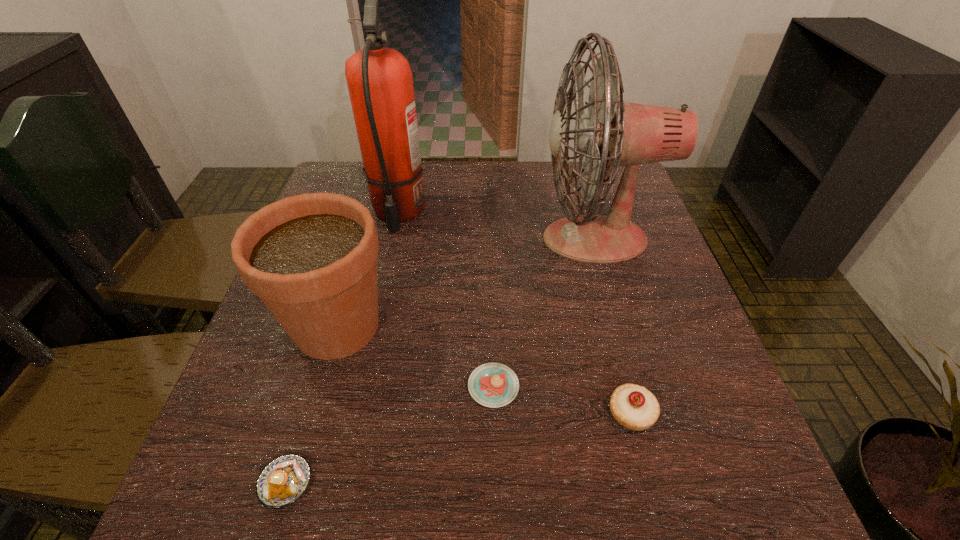
At what (x,y) coordinates should I click in order to perform the action: click on vacant space at the right edge. Please return your answer as a coordinate pair (x, y). Looking at the image, I should click on (720, 415).

You are a GUI agent. You are given a task and a screenshot of the screen. Output one action in this format:
    pyautogui.click(x=<x>, y=<y>)
    Task: Click on the vacant space at the near left corner of the desktop
    Image resolution: width=960 pixels, height=540 pixels.
    Given the screenshot: What is the action you would take?
    pyautogui.click(x=228, y=482)

Identify the location of vacant space at the far right corner. (585, 207).

Where is `free spot between the fan and the tallest pastry`? This screenshot has width=960, height=540. free spot between the fan and the tallest pastry is located at coordinates (612, 326).

Locate an element on the screen. The width and height of the screenshot is (960, 540). empty space that is in between the nearest object and the tallest pastry is located at coordinates (458, 448).

Where is `free point between the leftmost pastry and the second pastry from left to right`? Image resolution: width=960 pixels, height=540 pixels. free point between the leftmost pastry and the second pastry from left to right is located at coordinates pos(390,434).

The height and width of the screenshot is (540, 960). Identify the location of free space that is in between the fire extinguisher and the second pastry from right to left. (445, 299).

At what (x,y) coordinates should I click in order to perform the action: click on free spot between the fire extinguisher and the third object from right to left. Please return your answer as a coordinate pair (x, y). Looking at the image, I should click on click(445, 299).

What are the coordinates of `free space between the fan and the third object from right to left` in the screenshot? It's located at (544, 313).

Locate an element on the screen. The image size is (960, 540). free space between the fan and the fire extinguisher is located at coordinates (496, 225).